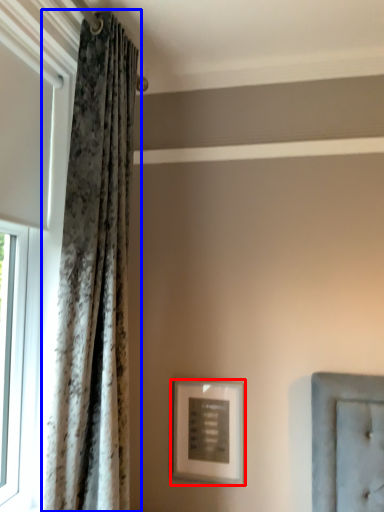
Question: Which object is further to the camera taking this photo, picture frame (highlighted by a red box) or curtain (highlighted by a blue box)?

Choices:
 (A) picture frame
 (B) curtain

Answer: (A)